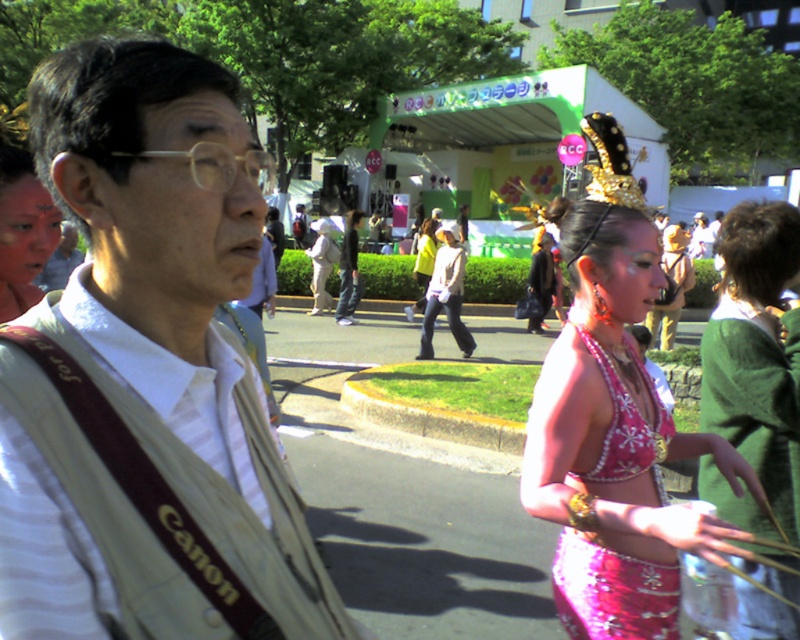
You are organizing a fashion show and need to arrange the pink sequined bikini top at right and the shiny pink bikini at center based on their size. Which one should be placed first in a display where larger items come first?

The shiny pink bikini at center should be placed first because it occupies more space than the pink sequined bikini top at right.

You are a photographer at the event and want to capture the pink sequined bikini top at right and the gold glittery crown at upper center in the same frame. Which object should you adjust your camera to focus on first to ensure both are in the shot?

The pink sequined bikini top at right is positioned on the left side of the gold glittery crown at upper center. To ensure both are in the frame, focus on the gold glittery crown at upper center first since it is higher up and adjust the camera angle to include the pink sequined bikini top at right to the left of it.